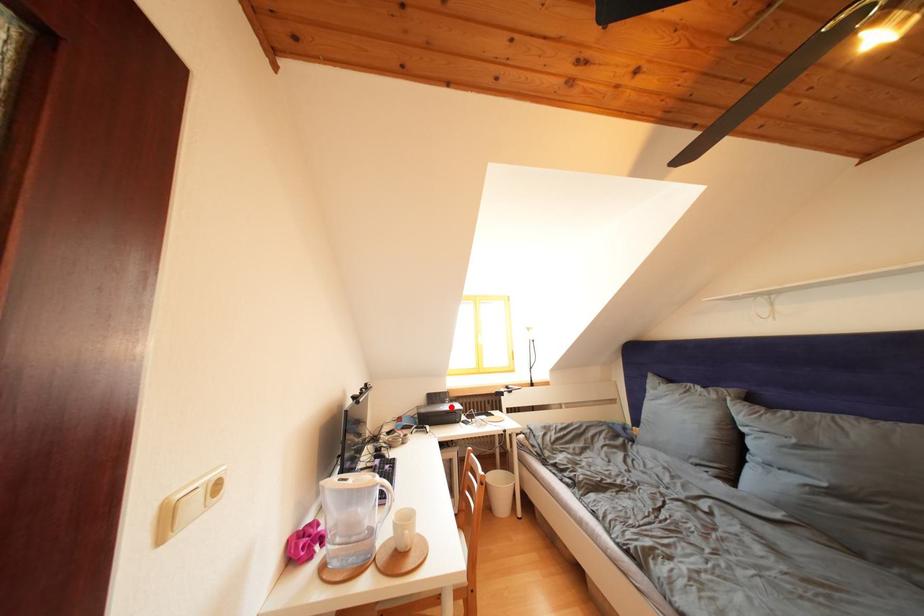
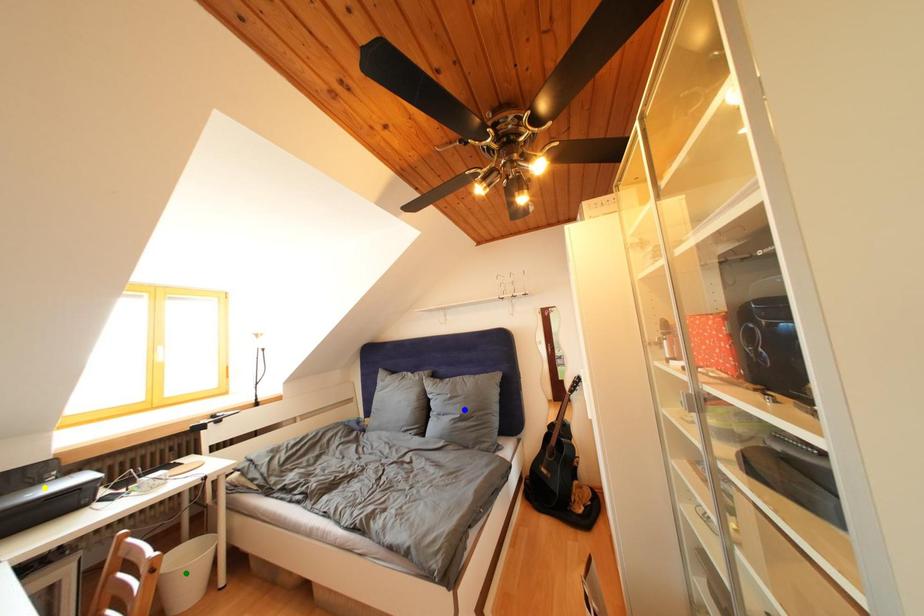
Question: I am providing you with two images of the same scene from different viewpoints. A red point is marked on the first image. You are given multiple points on the second image. In image 2, which mark is for the same physical point as the one in image 1?

Choices:
 (A) yellow point
 (B) blue point
 (C) green point

Answer: (A)